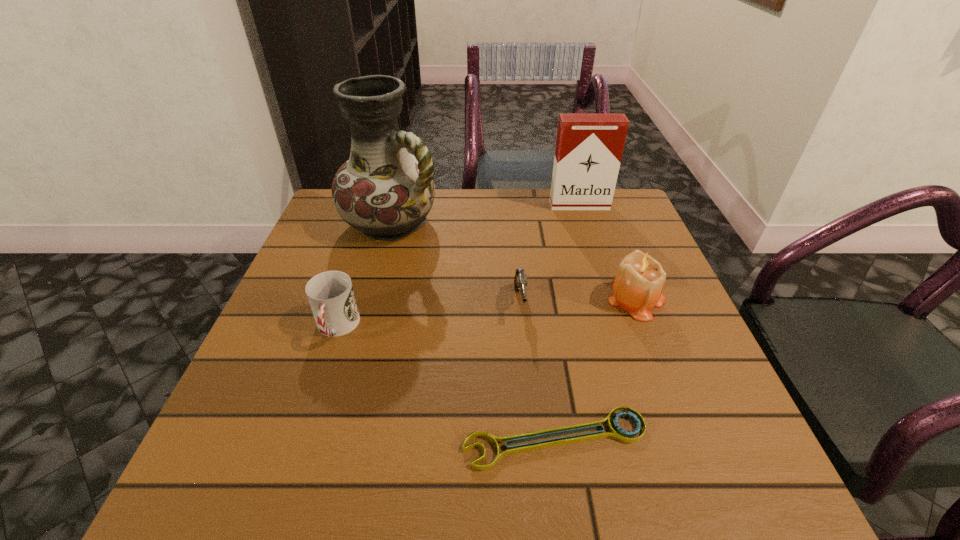
Identify the location of blank space located on the side of the cup where the handle is located. This screenshot has height=540, width=960. (301, 434).

You are a GUI agent. You are given a task and a screenshot of the screen. Output one action in this format:
    pyautogui.click(x=<x>, y=<y>)
    Task: Click on the vacant region located at the barrel of the pistol
    The height and width of the screenshot is (540, 960).
    Given the screenshot: What is the action you would take?
    pyautogui.click(x=536, y=461)

This screenshot has width=960, height=540. I want to click on vacant space located 0.080m on the left of the shortest object, so click(413, 438).

I want to click on vase located in the far edge section of the desktop, so click(383, 191).

You are a GUI agent. You are given a task and a screenshot of the screen. Output one action in this format:
    pyautogui.click(x=<x>, y=<y>)
    Task: Click on the cigarette_case positioned at the far edge
    
    Given the screenshot: What is the action you would take?
    click(x=589, y=147)

Identify the location of object situated at the near edge. The image size is (960, 540). (616, 432).

The image size is (960, 540). I want to click on vase that is positioned at the left edge, so click(383, 191).

Where is `cup that is at the left edge`? This screenshot has height=540, width=960. cup that is at the left edge is located at coordinates (330, 294).

Where is `cigarette_case at the right edge`? Image resolution: width=960 pixels, height=540 pixels. cigarette_case at the right edge is located at coordinates (589, 147).

At what (x,y) coordinates should I click in order to perform the action: click on candle at the right edge. Please return your answer as a coordinate pair (x, y). The height and width of the screenshot is (540, 960). Looking at the image, I should click on (637, 288).